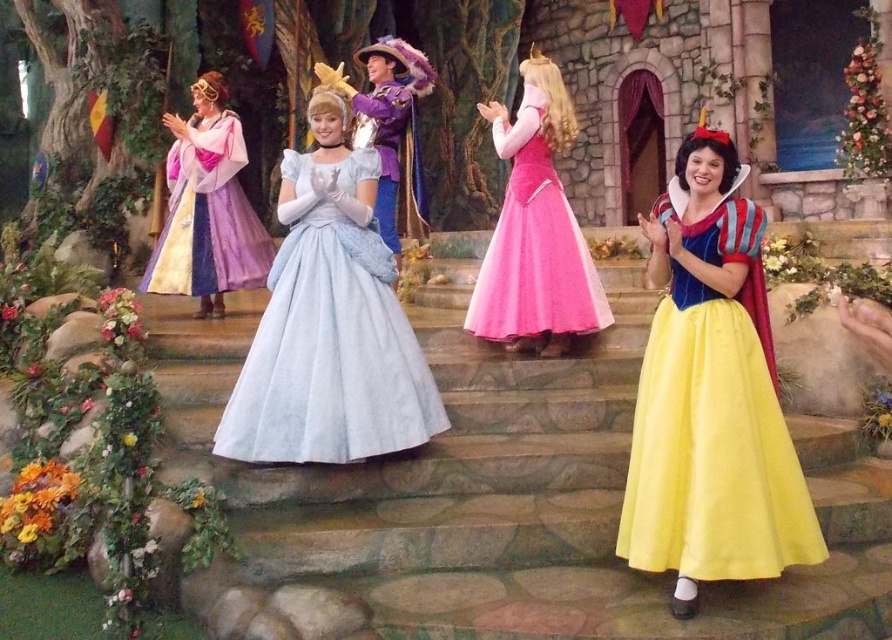
Between yellow satin dress at lower right and pastel purple satin dress at left, which one has less height?

Standing shorter between the two is pastel purple satin dress at left.

Is point (758, 484) positioned after point (153, 253)?

No, it is not.

Locate an element on the screen. This screenshot has width=892, height=640. yellow satin dress at lower right is located at coordinates (713, 420).

Does light blue satin dress at center appear on the left side of pink satin dress at center?

Correct, you'll find light blue satin dress at center to the left of pink satin dress at center.

Is point (341, 260) closer to viewer compared to point (514, 148)?

Yes, point (341, 260) is in front of point (514, 148).

Find the location of a particular element. This screenshot has width=892, height=640. light blue satin dress at center is located at coordinates (329, 336).

Who is more forward, (583,260) or (262,236)?

Positioned in front is point (583,260).

Find the location of a particular element. Image resolution: width=892 pixels, height=640 pixels. pink satin dress at center is located at coordinates (533, 243).